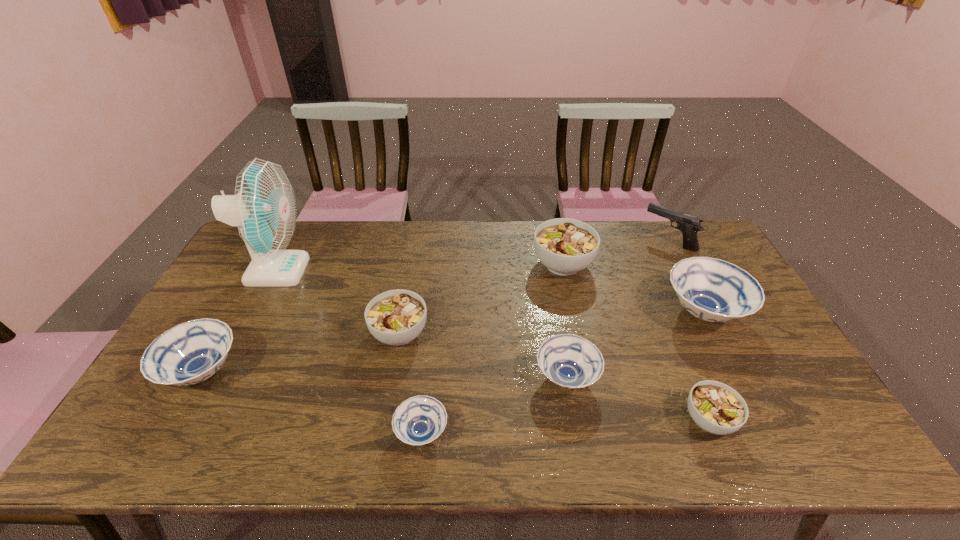
You are a GUI agent. You are given a task and a screenshot of the screen. Output one action in this format:
    pyautogui.click(x=<x>, y=<y>)
    Task: Click on the vacant region located on the front of the biggest blue soup bowl
    The image size is (960, 540).
    Given the screenshot: What is the action you would take?
    pyautogui.click(x=735, y=374)

What are the coordinates of `vacant region located 0.400m on the back of the second farthest white soup bowl` in the screenshot? It's located at (418, 233).

Where is `vacant space located on the right of the leftmost soup bowl`? The height and width of the screenshot is (540, 960). vacant space located on the right of the leftmost soup bowl is located at coordinates (318, 372).

What are the coordinates of `vacant space situated on the back of the second smallest blue soup bowl` in the screenshot? It's located at (549, 277).

Image resolution: width=960 pixels, height=540 pixels. Find the location of `free spot located 0.320m on the left of the nearest white soup bowl`. free spot located 0.320m on the left of the nearest white soup bowl is located at coordinates (550, 420).

Locate an element on the screen. The image size is (960, 540). vacant space located 0.130m on the right of the shortest soup bowl is located at coordinates tap(503, 432).

Identify the location of fan present at the far edge. Image resolution: width=960 pixels, height=540 pixels. (264, 208).

The height and width of the screenshot is (540, 960). Identify the location of gun that is at the far edge. (689, 225).

Identify the location of soup bowl present at the far edge. The image size is (960, 540). pos(565,246).

Locate an element on the screen. fan that is at the left edge is located at coordinates (264, 208).